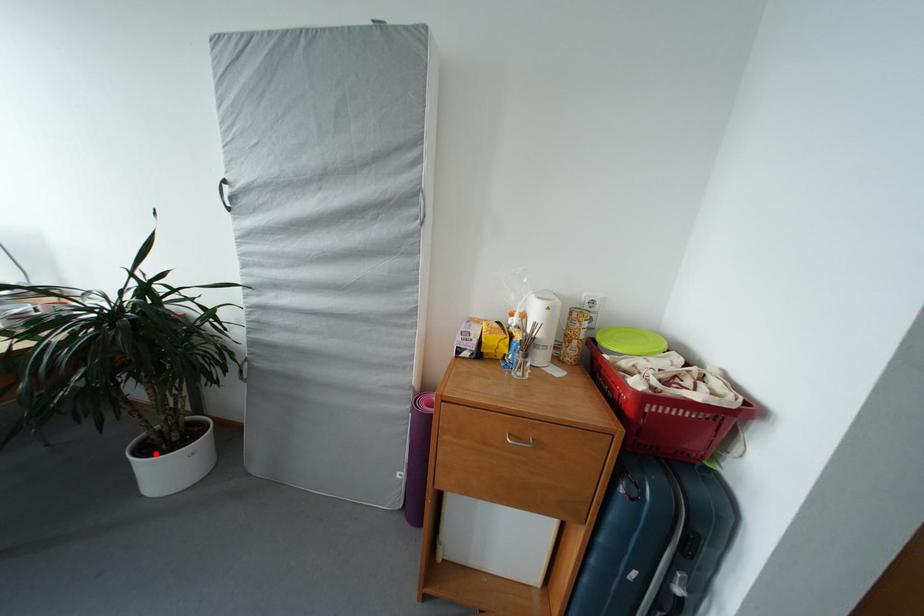
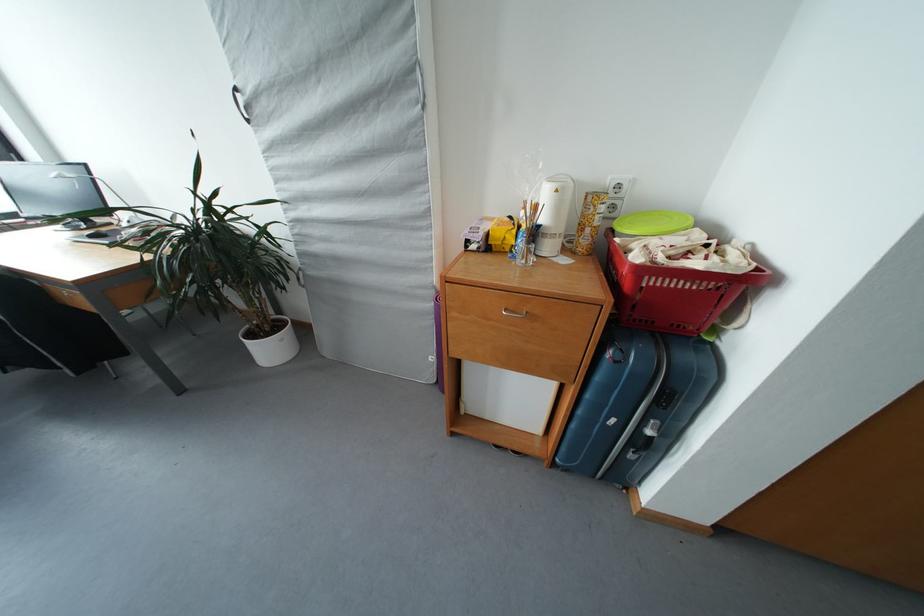
Find the pixel in the second image that matches the highlighted location in the first image.

(260, 339)